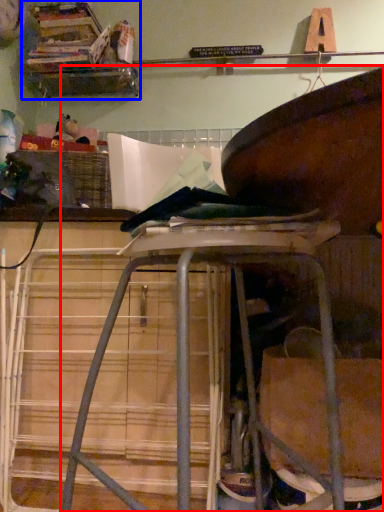
Question: Which of the following is the farthest to the observer, furniture (highlighted by a red box) or shelf (highlighted by a blue box)?

Choices:
 (A) furniture
 (B) shelf

Answer: (B)